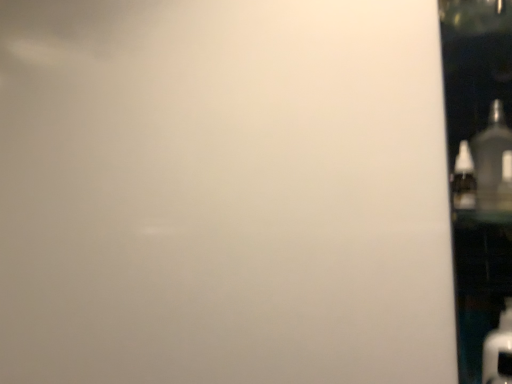
Question: Is clear plastic bottle at right, which is counted as the 2th bottle, starting from the right, oriented away from transparent glass door at right?

Choices:
 (A) no
 (B) yes

Answer: (B)

Question: From a real-world perspective, is clear plastic bottle at right, the 1th bottle from the left, located higher than transparent glass door at right?

Choices:
 (A) yes
 (B) no

Answer: (A)

Question: Can you see clear plastic bottle at right, which is counted as the 2th bottle, starting from the right, touching transparent glass door at right?

Choices:
 (A) yes
 (B) no

Answer: (B)

Question: Does clear plastic bottle at right, which is counted as the 2th bottle, starting from the right, have a greater width compared to transparent glass door at right?

Choices:
 (A) yes
 (B) no

Answer: (B)

Question: Is clear plastic bottle at right, which is counted as the 2th bottle, starting from the right, further to camera compared to transparent glass door at right?

Choices:
 (A) no
 (B) yes

Answer: (B)

Question: Based on their sizes in the image, would you say clear plastic bottle at right, the 1th bottle from the left, is bigger or smaller than transparent glass door at right?

Choices:
 (A) big
 (B) small

Answer: (B)

Question: From their relative heights in the image, would you say clear plastic bottle at right, the 1th bottle from the left, is taller or shorter than transparent glass door at right?

Choices:
 (A) tall
 (B) short

Answer: (B)

Question: From a real-world perspective, is clear plastic bottle at right, which is counted as the 2th bottle, starting from the right, physically located above or below transparent glass door at right?

Choices:
 (A) above
 (B) below

Answer: (A)

Question: Relative to transparent glass door at right, is clear plastic bottle at right, which is counted as the 2th bottle, starting from the right, in front or behind?

Choices:
 (A) behind
 (B) front

Answer: (A)

Question: Is matte black bottle at right, placed as the 1th bottle when sorted from right to left, situated inside clear plastic bottle at right, which is counted as the 2th bottle, starting from the right, or outside?

Choices:
 (A) inside
 (B) outside

Answer: (B)

Question: From the image's perspective, is matte black bottle at right, the 2th bottle viewed from the left, above or below clear plastic bottle at right, which is counted as the 2th bottle, starting from the right?

Choices:
 (A) above
 (B) below

Answer: (A)

Question: Relative to clear plastic bottle at right, the 1th bottle from the left, is matte black bottle at right, the 2th bottle viewed from the left, in front or behind?

Choices:
 (A) front
 (B) behind

Answer: (A)

Question: In terms of width, does matte black bottle at right, the 2th bottle viewed from the left, look wider or thinner when compared to clear plastic bottle at right, the 1th bottle from the left?

Choices:
 (A) thin
 (B) wide

Answer: (B)

Question: Relative to clear plastic bottle at right, the 1th bottle from the left, is transparent glass door at right in front or behind?

Choices:
 (A) behind
 (B) front

Answer: (B)

Question: Based on their sizes in the image, would you say transparent glass door at right is bigger or smaller than clear plastic bottle at right, the 1th bottle from the left?

Choices:
 (A) big
 (B) small

Answer: (A)